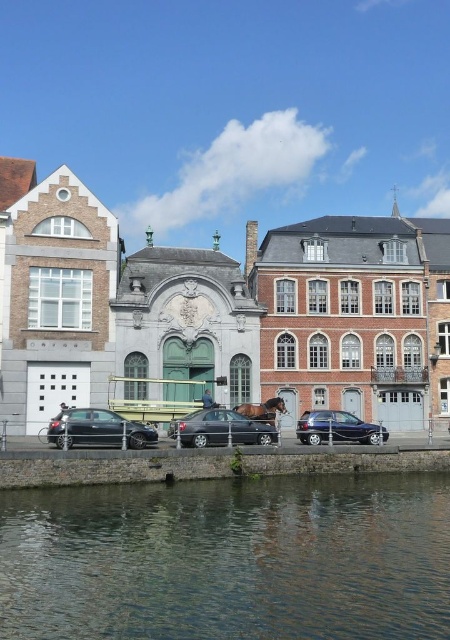
Question: Which point is farther from the camera taking this photo?

Choices:
 (A) [x=217, y=413]
 (B) [x=382, y=621]
 (C) [x=343, y=417]

Answer: (C)

Question: Does transparent water at lower center have a greater width compared to satin black car at center?

Choices:
 (A) yes
 (B) no

Answer: (A)

Question: Considering the real-world distances, which object is farthest from the transparent water at lower center?

Choices:
 (A) shiny silver sedan at center
 (B) brown glossy horse at center

Answer: (B)

Question: Is transparent water at lower center thinner than shiny black sedan at lower left?

Choices:
 (A) yes
 (B) no

Answer: (B)

Question: Does transparent water at lower center have a smaller size compared to shiny black sedan at lower left?

Choices:
 (A) no
 (B) yes

Answer: (A)

Question: Which object is the closest to the brown glossy horse at center?

Choices:
 (A) shiny black sedan at lower left
 (B) satin black car at center
 (C) shiny silver sedan at center

Answer: (B)